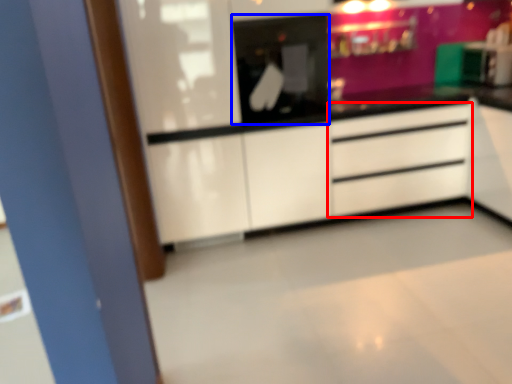
Question: Among these objects, which one is nearest to the camera, chest of drawers (highlighted by a red box) or appliance (highlighted by a blue box)?

Choices:
 (A) chest of drawers
 (B) appliance

Answer: (B)